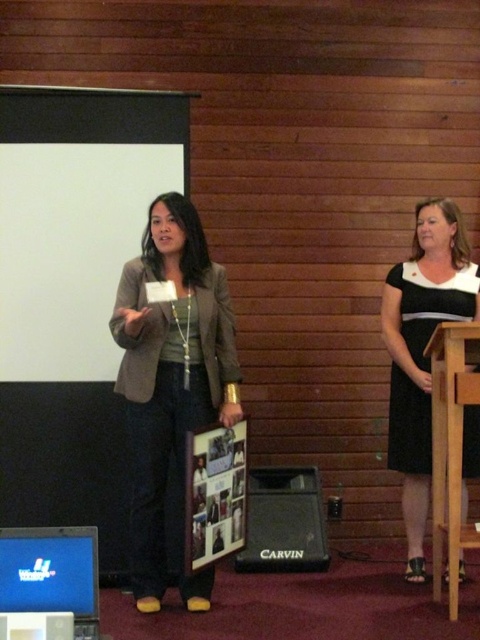
You are a stagehand setting up a new microphone stand for a speaker. The existing microphone is at point (x=250, y=488). You need to place the new stand at point (x=424, y=296) so it doesn t block the speaker s path. Will the new stand be in front of or behind the existing one?

The new stand at point (x=424, y=296) will be in front of the existing microphone at point (x=250, y=488) because point (x=424, y=296) is in front of point (x=250, y=488).

You are an event organizer setting up a presentation. You have a white matte projection screen at upper left and a black plastic speaker at lower center. Which object should you adjust first if you need to ensure both are visible to the audience? Explain your reasoning.

The white matte projection screen at upper left should be adjusted first since it is bigger than the black plastic speaker at lower center, making it more prominent and critical for the audience to see the presentation content clearly.